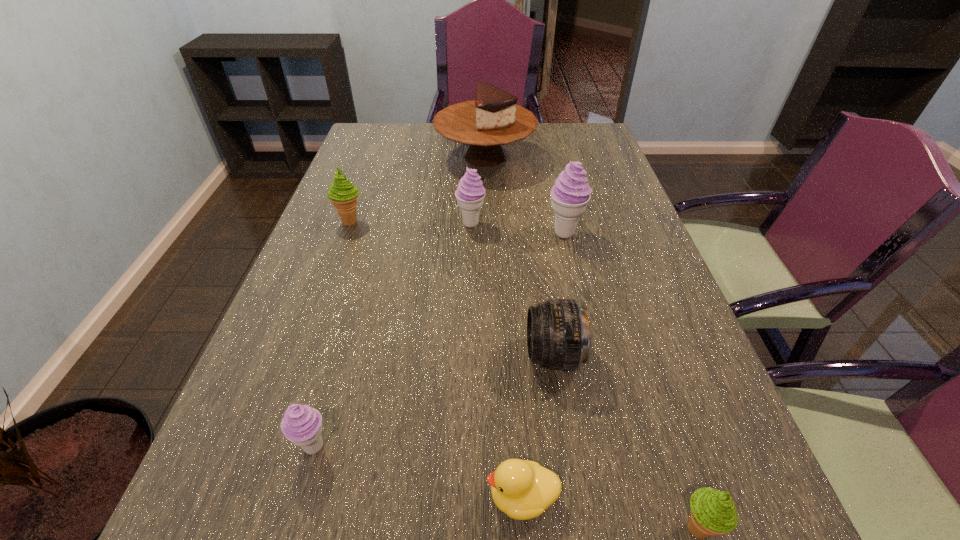
Locate an element on the screen. The height and width of the screenshot is (540, 960). vacant space that is in between the telephoto lens and the seventh object from right to left is located at coordinates (x=434, y=401).

This screenshot has height=540, width=960. I want to click on unoccupied area between the fourth nearest object and the yellow duckling, so click(538, 426).

Where is `unoccupied position between the fifth farthest object and the fourth icecream from left to right`? Image resolution: width=960 pixels, height=540 pixels. unoccupied position between the fifth farthest object and the fourth icecream from left to right is located at coordinates (559, 294).

Locate an element on the screen. This screenshot has width=960, height=540. vacant area between the shortest object and the telephoto lens is located at coordinates (538, 426).

Image resolution: width=960 pixels, height=540 pixels. Find the location of `free space between the leftmost purple icecream and the fourth nearest object`. free space between the leftmost purple icecream and the fourth nearest object is located at coordinates (434, 401).

Image resolution: width=960 pixels, height=540 pixels. I want to click on vacant region between the seventh object from right to left and the second purple icecream from left to right, so click(393, 335).

Where is `vacant area that lies between the smallest purple icecream and the yellow duckling`? The height and width of the screenshot is (540, 960). vacant area that lies between the smallest purple icecream and the yellow duckling is located at coordinates (418, 471).

At what (x,y) coordinates should I click in order to perform the action: click on vacant area between the red cake and the rightmost purple icecream. Please return your answer as a coordinate pair (x, y). This screenshot has width=960, height=540. Looking at the image, I should click on (525, 195).

Where is `object that is the sixth closest to the rightmost purple icecream`? The image size is (960, 540). object that is the sixth closest to the rightmost purple icecream is located at coordinates (713, 512).

You are a GUI agent. You are given a task and a screenshot of the screen. Output one action in this format:
    pyautogui.click(x=<x>, y=<y>)
    Task: Click on the third closest object to the rightmost purple icecream
    The width and height of the screenshot is (960, 540).
    Given the screenshot: What is the action you would take?
    pyautogui.click(x=558, y=336)